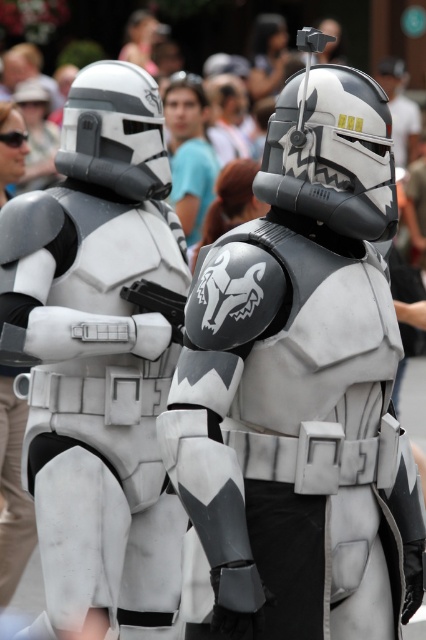
Question: Is blue cotton shirt at center to the left of matte black helmet at upper center from the viewer's perspective?

Choices:
 (A) no
 (B) yes

Answer: (B)

Question: Can you confirm if matte white armor at center is smaller than blue cotton shirt at center?

Choices:
 (A) no
 (B) yes

Answer: (B)

Question: Among these points, which one is farthest from the camera?

Choices:
 (A) (402, 72)
 (B) (222, 292)
 (C) (144, 104)
 (D) (189, 227)

Answer: (A)

Question: Which point appears closest to the camera in this image?

Choices:
 (A) (397, 83)
 (B) (129, 240)
 (C) (215, 156)

Answer: (B)

Question: Does white matte armor at center lie behind matte black helmet at upper center?

Choices:
 (A) yes
 (B) no

Answer: (B)

Question: Which of the following is the farthest from the observer?

Choices:
 (A) blue cotton shirt at center
 (B) matte black helmet at upper center
 (C) matte white armor at center
 (D) white matte armor at center

Answer: (B)